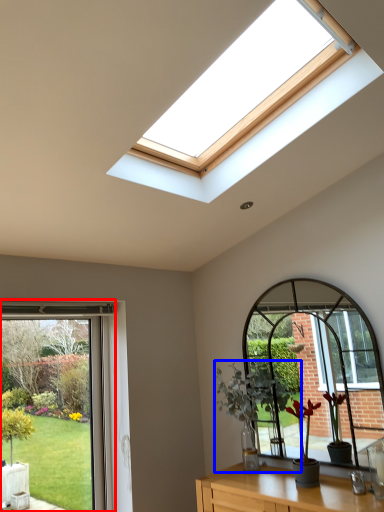
Question: Which point is further to the camera, window (highlighted by a red box) or houseplant (highlighted by a blue box)?

Choices:
 (A) window
 (B) houseplant

Answer: (B)